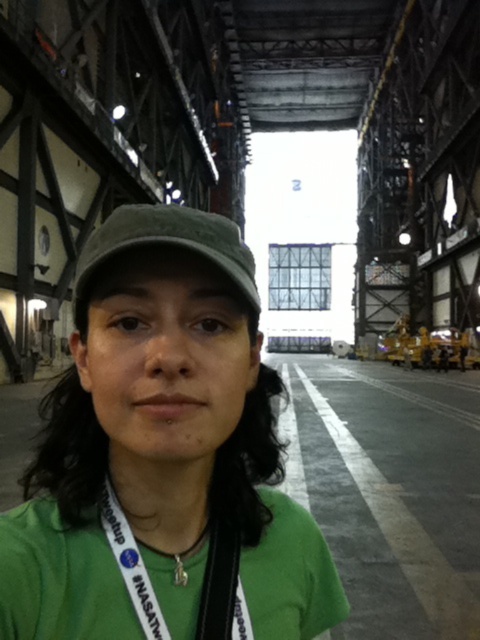
Question: Which object appears farthest from the camera in this image?

Choices:
 (A) green matte cap at center
 (B) green fabric cap at center
 (C) green fabric at center

Answer: (B)

Question: Which object appears closest to the camera in this image?

Choices:
 (A) green matte cap at center
 (B) white fabric lanyard at center

Answer: (A)

Question: Does green matte cap at center have a larger size compared to green fabric cap at center?

Choices:
 (A) no
 (B) yes

Answer: (A)

Question: Which point is closer to the camera taking this photo?

Choices:
 (A) (180, 484)
 (B) (180, 211)
 (C) (235, 592)

Answer: (B)

Question: Considering the relative positions of green fabric at center and white fabric lanyard at center in the image provided, where is green fabric at center located with respect to white fabric lanyard at center?

Choices:
 (A) left
 (B) right

Answer: (A)

Question: Does green matte cap at center have a smaller size compared to white fabric lanyard at center?

Choices:
 (A) no
 (B) yes

Answer: (A)